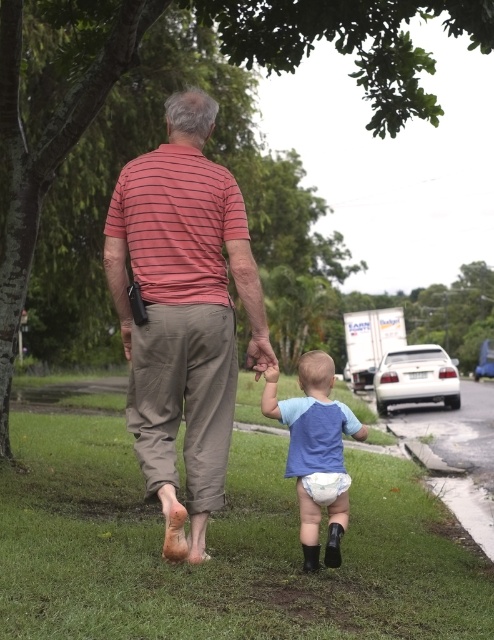
Can you confirm if green grass at lower center is positioned above striped cotton shirt at center?

Actually, green grass at lower center is below striped cotton shirt at center.

At what (x,y) coordinates should I click in order to perform the action: click on green grass at lower center. Please return your answer as a coordinate pair (x, y). Looking at the image, I should click on (222, 548).

Is blue fabric diaper at lower center to the left of white cloth diaper at lower center from the viewer's perspective?

Correct, you'll find blue fabric diaper at lower center to the left of white cloth diaper at lower center.

How much distance is there between blue fabric diaper at lower center and white cloth diaper at lower center?

blue fabric diaper at lower center is 4.48 inches from white cloth diaper at lower center.

Image resolution: width=494 pixels, height=640 pixels. Describe the element at coordinates (316, 451) in the screenshot. I see `blue fabric diaper at lower center` at that location.

Where is `blue fabric diaper at lower center`? blue fabric diaper at lower center is located at coordinates (316, 451).

Which is more to the right, striped cotton shirt at center or blue fabric diaper at lower center?

blue fabric diaper at lower center is more to the right.

Which is behind, point (188, 243) or point (336, 500)?

Point (336, 500)

The width and height of the screenshot is (494, 640). I want to click on striped cotton shirt at center, so click(182, 314).